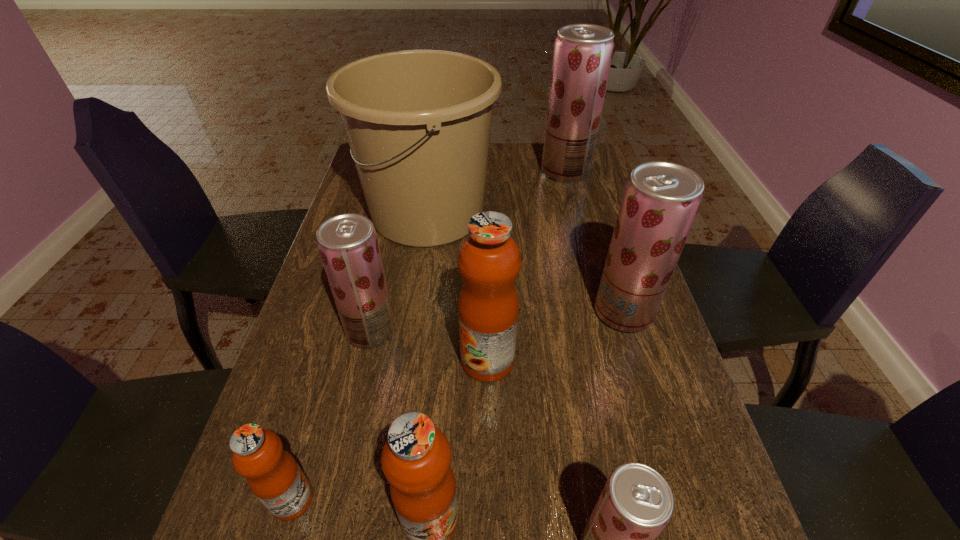
This screenshot has width=960, height=540. Identify the location of the farthest fruit juice. 582,57.

Image resolution: width=960 pixels, height=540 pixels. What are the coordinates of `the biggest strawberry fruit juice` in the screenshot? It's located at (582, 57).

At what (x,y) coordinates should I click in order to perform the action: click on beige bucket. Please return your answer as a coordinate pair (x, y). The width and height of the screenshot is (960, 540). Looking at the image, I should click on (418, 122).

I want to click on the second biggest strawberry fruit juice, so click(661, 199).

Image resolution: width=960 pixels, height=540 pixels. In order to click on the biggest orange fruit juice in this screenshot , I will do `click(489, 260)`.

The height and width of the screenshot is (540, 960). What are the coordinates of `the leftmost strawberry fruit juice` in the screenshot? It's located at (348, 245).

You are a GUI agent. You are given a task and a screenshot of the screen. Output one action in this format:
    pyautogui.click(x=<x>, y=<y>)
    Task: Click on the smallest orange fruit juice
    
    Given the screenshot: What is the action you would take?
    pyautogui.click(x=273, y=475)

Identify the location of vacant area situated on the left of the farthest strawberry fruit juice. The image size is (960, 540). (441, 172).

You are a GUI agent. You are given a task and a screenshot of the screen. Output one action in this format:
    pyautogui.click(x=<x>, y=<y>)
    Task: Click on the free space located 0.060m on the front of the bucket
    
    Given the screenshot: What is the action you would take?
    pyautogui.click(x=419, y=276)

The image size is (960, 540). What are the coordinates of `free location located on the front of the second biggest strawberry fruit juice` in the screenshot? It's located at (647, 388).